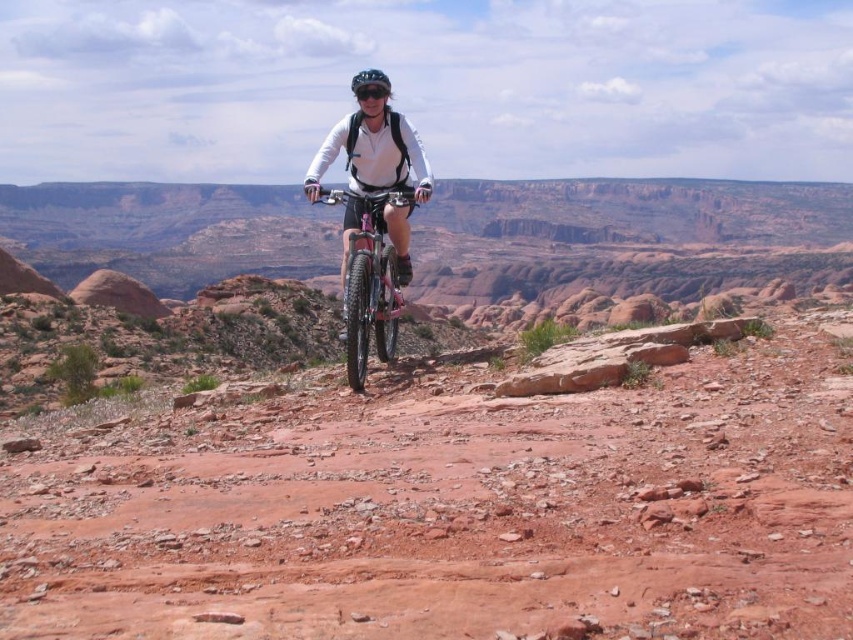
Question: Is pink matte bicycle at center below matte black helmet at center?

Choices:
 (A) yes
 (B) no

Answer: (A)

Question: Which of these objects is positioned closest to the pink matte bicycle at center?

Choices:
 (A) reddish-brown rocky dirt track at center
 (B) matte black helmet at center

Answer: (B)

Question: Which is farther from the pink matte bicycle at center?

Choices:
 (A) reddish-brown rocky dirt track at center
 (B) matte black helmet at center

Answer: (A)

Question: Which of the following is the closest to the observer?

Choices:
 (A) matte black helmet at center
 (B) reddish-brown rocky dirt track at center
 (C) pink matte bicycle at center

Answer: (B)

Question: Can you confirm if reddish-brown rocky dirt track at center is bigger than pink matte bicycle at center?

Choices:
 (A) no
 (B) yes

Answer: (B)

Question: Can you confirm if reddish-brown rocky dirt track at center is smaller than pink matte bicycle at center?

Choices:
 (A) no
 (B) yes

Answer: (A)